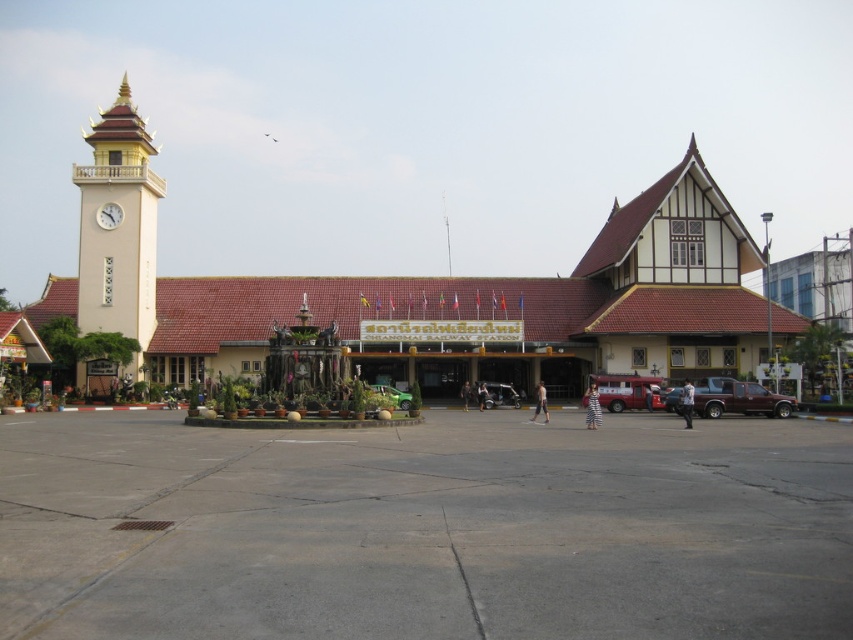
Can you confirm if concrete at center is positioned to the left of metallic red van at center?

Correct, you'll find concrete at center to the left of metallic red van at center.

The image size is (853, 640). Identify the location of concrete at center. (425, 529).

At what (x,y) coordinates should I click in order to perform the action: click on concrete at center. Please return your answer as a coordinate pair (x, y). This screenshot has height=640, width=853. Looking at the image, I should click on (425, 529).

Is satin brown truck at center in front of metallic silver car at center?

Yes.

Is point (737, 394) closer to camera compared to point (502, 397)?

Yes.

Between point (746, 384) and point (483, 400), which one is positioned behind?

The point (483, 400) is more distant.

This screenshot has width=853, height=640. I want to click on satin brown truck at center, so click(740, 397).

Is beige stucco clock tower at left above satin brown truck at center?

Yes.

I want to click on beige stucco clock tower at left, so click(x=119, y=228).